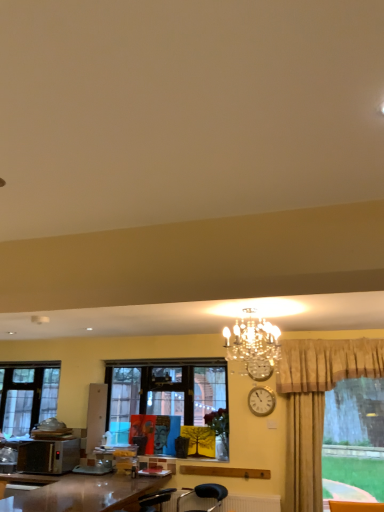
Question: From a real-world perspective, is matte wooden picture frame at center positioned over matte blue painting at center based on gravity?

Choices:
 (A) no
 (B) yes

Answer: (B)

Question: From the image's perspective, is matte wooden picture frame at center located beneath matte blue painting at center?

Choices:
 (A) yes
 (B) no

Answer: (A)

Question: From a real-world perspective, is matte wooden picture frame at center beneath matte blue painting at center?

Choices:
 (A) yes
 (B) no

Answer: (B)

Question: Is matte wooden picture frame at center thinner than matte blue painting at center?

Choices:
 (A) no
 (B) yes

Answer: (A)

Question: Does matte wooden picture frame at center have a lesser height compared to matte blue painting at center?

Choices:
 (A) yes
 (B) no

Answer: (B)

Question: From the image's perspective, is matte wooden picture frame at center over matte blue painting at center?

Choices:
 (A) no
 (B) yes

Answer: (A)

Question: Does silver metallic microwave oven at lower left have a lesser height compared to silver metallic clock at upper center, placed as the 1th clock when sorted from bottom to top?

Choices:
 (A) yes
 (B) no

Answer: (B)

Question: Is silver metallic microwave oven at lower left thinner than silver metallic clock at upper center, which is the second clock in top-to-bottom order?

Choices:
 (A) no
 (B) yes

Answer: (A)

Question: Is silver metallic microwave oven at lower left positioned beyond the bounds of silver metallic clock at upper center, placed as the 1th clock when sorted from bottom to top?

Choices:
 (A) yes
 (B) no

Answer: (A)

Question: Considering the relative sizes of silver metallic microwave oven at lower left and silver metallic clock at upper center, placed as the 1th clock when sorted from bottom to top, in the image provided, is silver metallic microwave oven at lower left bigger than silver metallic clock at upper center, placed as the 1th clock when sorted from bottom to top,?

Choices:
 (A) yes
 (B) no

Answer: (A)

Question: Does silver metallic microwave oven at lower left lie in front of silver metallic clock at upper center, which is the second clock in top-to-bottom order?

Choices:
 (A) no
 (B) yes

Answer: (A)

Question: From a real-world perspective, does silver metallic microwave oven at lower left sit lower than silver metallic clock at upper center, placed as the 1th clock when sorted from bottom to top?

Choices:
 (A) no
 (B) yes

Answer: (B)

Question: Is matte wooden picture frame at center taller than silver metallic microwave oven at lower left?

Choices:
 (A) yes
 (B) no

Answer: (A)